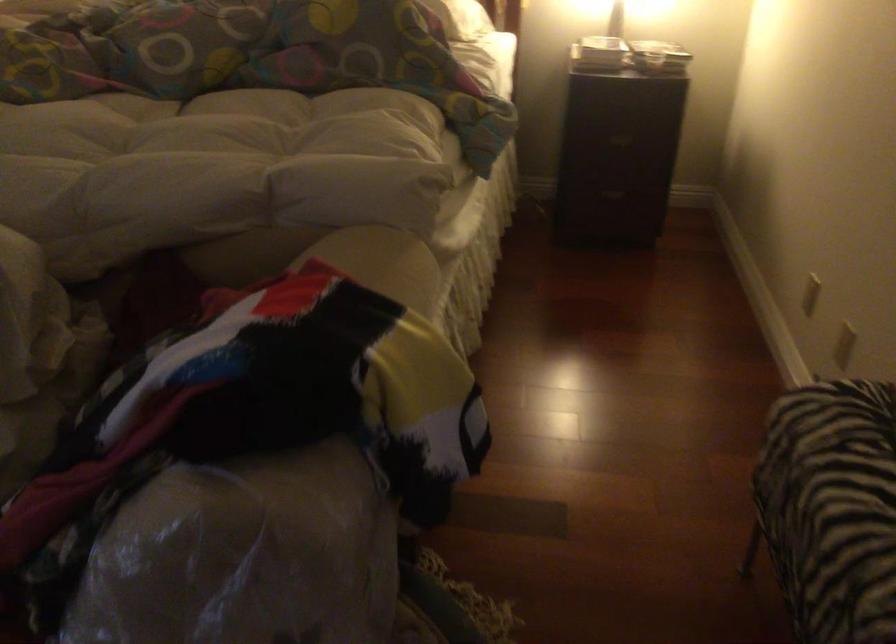
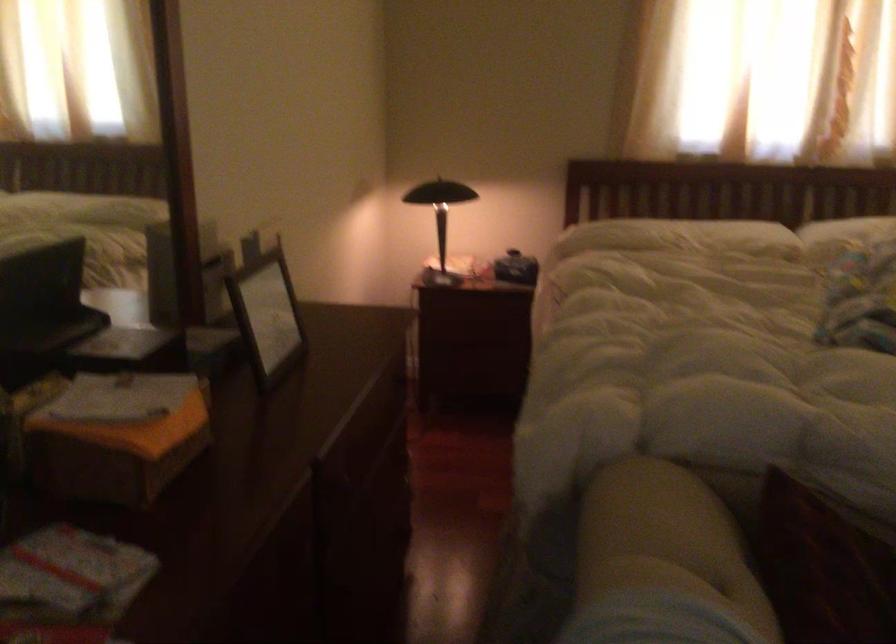
Question: What movement of the cameraman would produce the second image?

Choices:
 (A) Left
 (B) Right
 (C) Forward
 (D) Backward

Answer: (A)